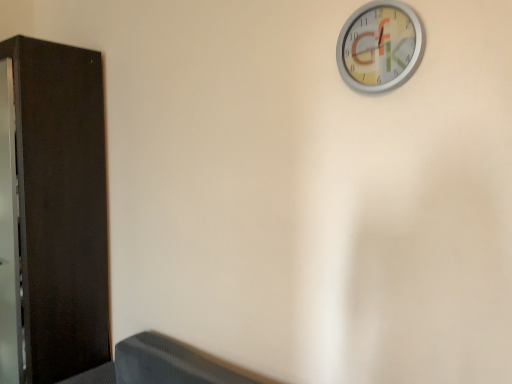
Describe the element at coordinates (52, 213) in the screenshot. I see `dark wood dresser at left` at that location.

The image size is (512, 384). I want to click on dark wood dresser at left, so click(x=52, y=213).

In order to face dark wood dresser at left, should I rotate leftwards or rightwards?

A 27.416 degree turn to the left will do.

Image resolution: width=512 pixels, height=384 pixels. Describe the element at coordinates (379, 46) in the screenshot. I see `metallic silver clock at upper right` at that location.

Find the location of a particular element. metallic silver clock at upper right is located at coordinates (379, 46).

The width and height of the screenshot is (512, 384). I want to click on dark wood dresser at left, so click(x=52, y=213).

Between metallic silver clock at upper right and dark wood dresser at left, which one appears on the left side from the viewer's perspective?

Positioned to the left is dark wood dresser at left.

Considering the positions of objects metallic silver clock at upper right and dark wood dresser at left in the image provided, who is behind, metallic silver clock at upper right or dark wood dresser at left?

dark wood dresser at left is further from the camera.

Is point (340, 60) closer or farther from the camera than point (45, 373)?

Clearly, point (340, 60) is closer to the camera than point (45, 373).

From the image's perspective, would you say metallic silver clock at upper right is shown under dark wood dresser at left?

Actually, metallic silver clock at upper right appears above dark wood dresser at left in the image.

From a real-world perspective, is metallic silver clock at upper right physically below dark wood dresser at left?

No, from a real-world perspective, metallic silver clock at upper right is not below dark wood dresser at left.

Is metallic silver clock at upper right wider than dark wood dresser at left?

Incorrect, the width of metallic silver clock at upper right does not surpass that of dark wood dresser at left.

Consider the image. Which of these two, metallic silver clock at upper right or dark wood dresser at left, stands taller?

Standing taller between the two is dark wood dresser at left.

Considering the sizes of metallic silver clock at upper right and dark wood dresser at left in the image, is metallic silver clock at upper right bigger or smaller than dark wood dresser at left?

metallic silver clock at upper right is smaller than dark wood dresser at left.

Is dark wood dresser at left a part of metallic silver clock at upper right?

That's incorrect, dark wood dresser at left is not inside metallic silver clock at upper right.

Is metallic silver clock at upper right touching dark wood dresser at left?

No, metallic silver clock at upper right is not touching dark wood dresser at left.

Is metallic silver clock at upper right facing towards dark wood dresser at left?

No, metallic silver clock at upper right does not turn towards dark wood dresser at left.

Can you tell me how much metallic silver clock at upper right and dark wood dresser at left differ in facing direction?

There is a 1.12-degree angle between the facing directions of metallic silver clock at upper right and dark wood dresser at left.

Find the location of a particular element. wall clock lying on the right of dark wood dresser at left is located at coordinates (379, 46).

From the picture: Which is more to the left, dark wood dresser at left or metallic silver clock at upper right?

dark wood dresser at left is more to the left.

Considering the positions of objects dark wood dresser at left and metallic silver clock at upper right in the image provided, who is in front, dark wood dresser at left or metallic silver clock at upper right?

metallic silver clock at upper right is more forward.

Is point (9, 256) positioned in front of point (418, 46)?

No.

From the image's perspective, is dark wood dresser at left above metallic silver clock at upper right?

No, from the image's perspective, dark wood dresser at left is not over metallic silver clock at upper right.

From a real-world perspective, between dark wood dresser at left and metallic silver clock at upper right, who is vertically lower?

dark wood dresser at left, from a real-world perspective.

Between dark wood dresser at left and metallic silver clock at upper right, which one has smaller width?

metallic silver clock at upper right.

In the scene shown: Is dark wood dresser at left taller than metallic silver clock at upper right?

Indeed, dark wood dresser at left has a greater height compared to metallic silver clock at upper right.

Who is smaller, dark wood dresser at left or metallic silver clock at upper right?

Smaller between the two is metallic silver clock at upper right.

Choose the correct answer: Is dark wood dresser at left inside metallic silver clock at upper right or outside it?

dark wood dresser at left is not enclosed by metallic silver clock at upper right.

Is dark wood dresser at left positioned far away from metallic silver clock at upper right?

dark wood dresser at left is positioned a significant distance from metallic silver clock at upper right.

Is dark wood dresser at left turned away from metallic silver clock at upper right?

No, metallic silver clock at upper right is not at the back of dark wood dresser at left.

In order to click on wall clock on the right side of dark wood dresser at left in this screenshot , I will do point(379,46).

This screenshot has height=384, width=512. In order to click on wall clock on the right side of dark wood dresser at left in this screenshot , I will do `click(379, 46)`.

I want to click on wall clock that appears in front of the dark wood dresser at left, so click(x=379, y=46).